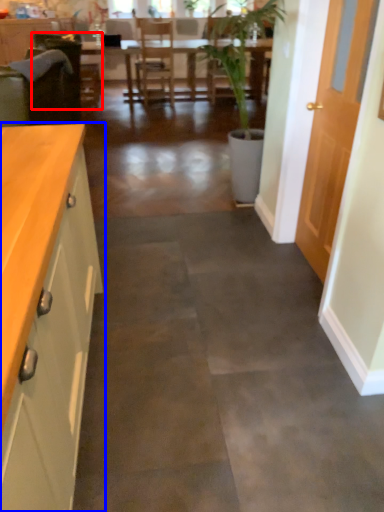
Question: Which point is closer to the camera, armchair (highlighted by a red box) or cabinetry (highlighted by a blue box)?

Choices:
 (A) armchair
 (B) cabinetry

Answer: (B)